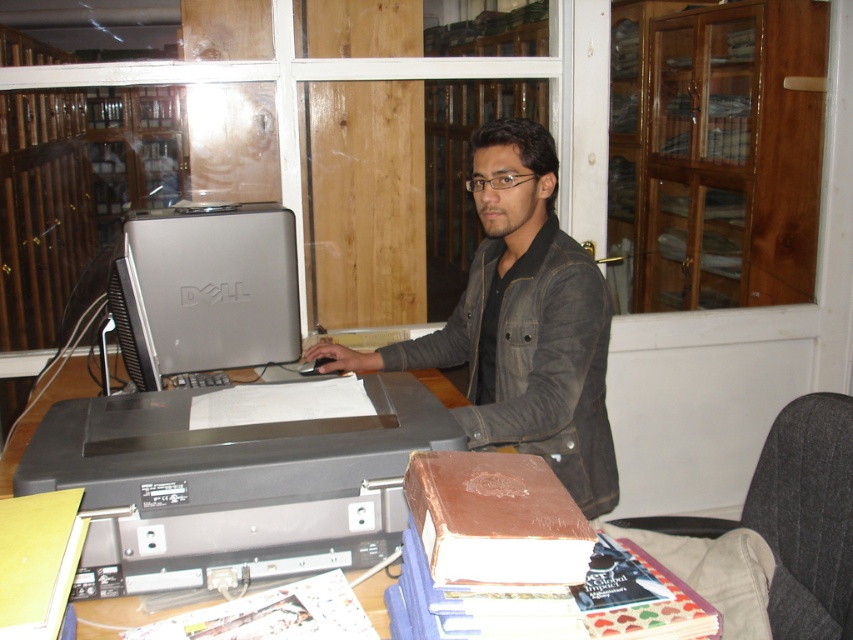
What are the coordinates of the black plastic printer at center?

The black plastic printer at center is located at coordinates point [231,484].

You are a visitor in the room and want to place a new document on the desk. The desk has limited space. Which object should you move to make space, the black plastic printer at center or the dark gray fabric chair at lower right?

You should move the black plastic printer at center because it is closer to the viewer and thus more accessible to move compared to the dark gray fabric chair at lower right, which is further away.

You are organizing the desk and need to move the black plastic printer at center and the dark brown leather jacket at center to make more space. Which item should you move first to free up the most desk space?

The dark brown leather jacket at center occupies more space than the black plastic printer at center, so moving it first would free up more desk space.